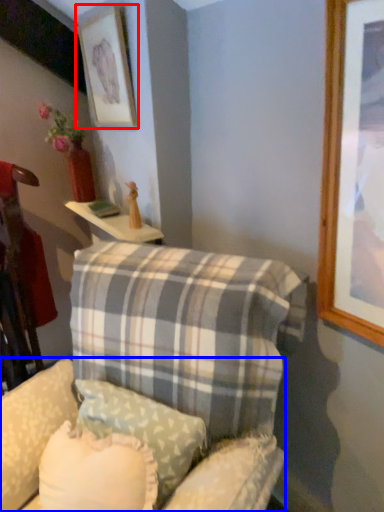
Question: Which object is closer to the camera taking this photo, picture frame (highlighted by a red box) or swivel chair (highlighted by a blue box)?

Choices:
 (A) picture frame
 (B) swivel chair

Answer: (B)